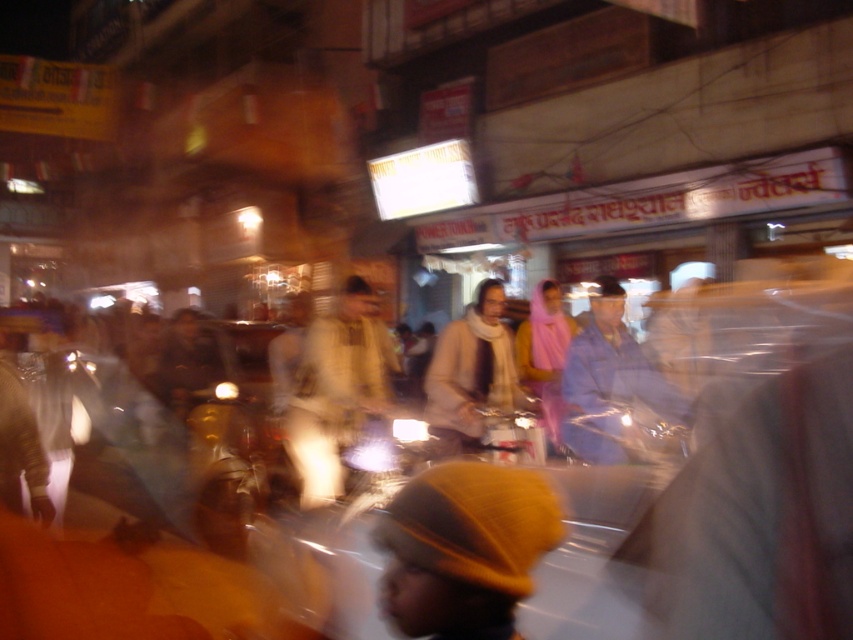
You are a photographer trying to capture a clear image of the blue fabric jacket at center and the white woolen scarf at center. Since the scene is moving, you need to know which one is closer to adjust your focus. Can you determine which is closer based on their positions?

The blue fabric jacket at center is positioned over the white woolen scarf at center, so the blue fabric jacket at center is closer to the camera than the white woolen scarf at center.

You are a street vendor in the bustling night market and you need to cover your goods with the light beige fabric at center and the white woolen scarf at center. Which one should you use to cover more items?

The light beige fabric at center is bigger than the white woolen scarf at center, so you should use the light beige fabric at center to cover more items.